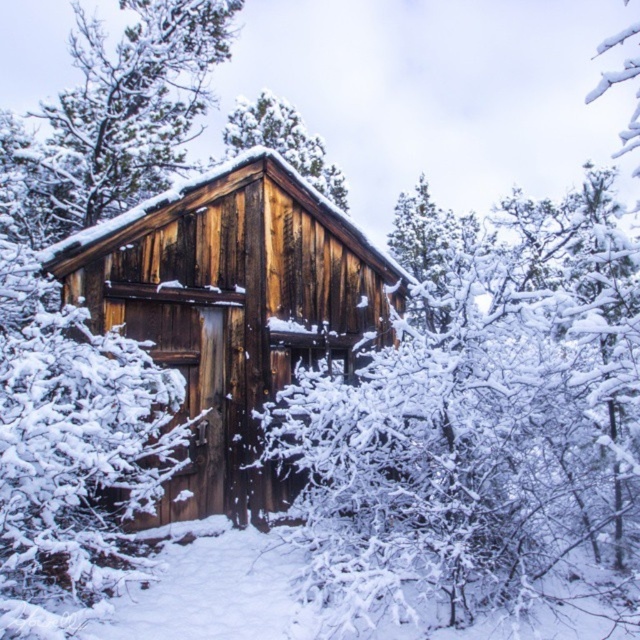
Question: In this image, where is wooden cabin at center located relative to snow-covered pine tree at center?

Choices:
 (A) right
 (B) left

Answer: (A)

Question: Which point appears closest to the camera in this image?

Choices:
 (A) (211, 493)
 (B) (147, 189)
 (C) (337, 188)

Answer: (A)

Question: Can you confirm if wooden cabin at center is positioned to the left of snow-covered pine tree at center?

Choices:
 (A) yes
 (B) no

Answer: (B)

Question: Is wooden cabin at center positioned at the back of snow-covered pine tree at center?

Choices:
 (A) no
 (B) yes

Answer: (A)

Question: Which point is farther from the camera taking this photo?

Choices:
 (A) (192, 106)
 (B) (148, 317)

Answer: (A)

Question: Which of the following is the farthest from the observer?

Choices:
 (A) snow-covered pine tree at center
 (B) wooden cabin at center
 (C) snow-covered pine tree at upper left

Answer: (A)